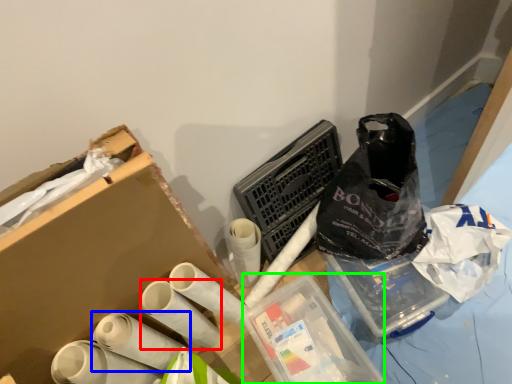
Question: Estimate the real-world distances between objects in this image. Which object is closer to toilet paper (highlighted by a red box), toilet paper (highlighted by a blue box) or box (highlighted by a green box)?

Choices:
 (A) toilet paper
 (B) box

Answer: (A)